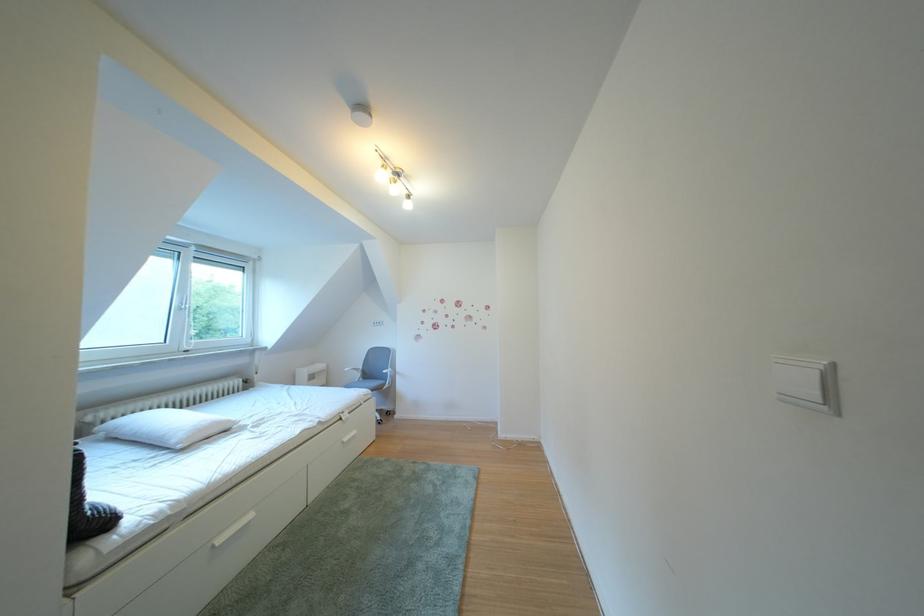
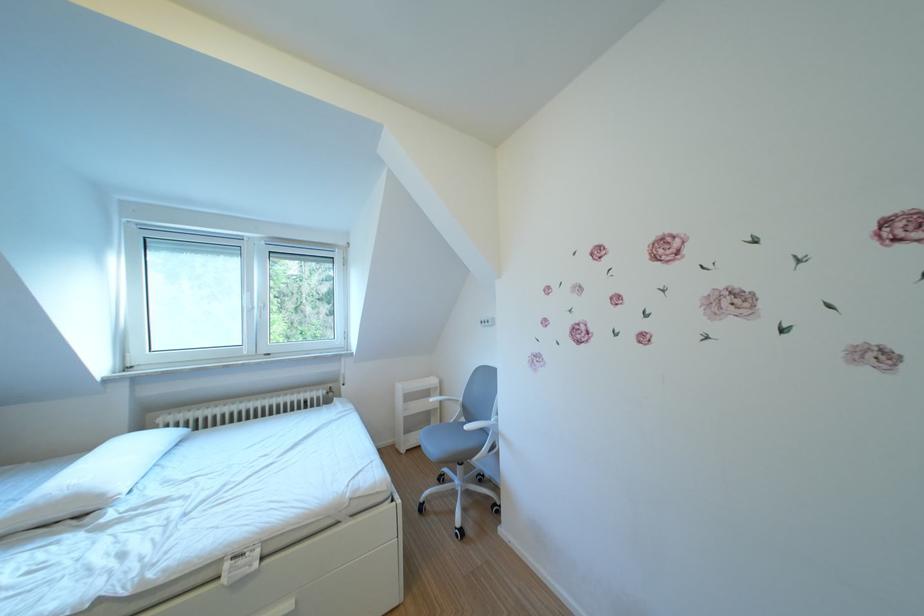
Where in the second image is the point corresponding to (242,427) from the first image?

(115, 501)